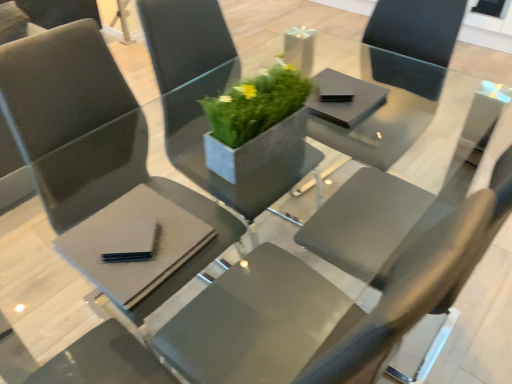
Question: Is black matte pad at lower left, arranged as the first pad when ordered from the bottom, positioned beyond the bounds of black matte napkin at center, the 1th pad from the top?

Choices:
 (A) yes
 (B) no

Answer: (A)

Question: Is black matte pad at lower left, arranged as the first pad when ordered from the bottom, far away from black matte napkin at center, marked as the first pad in a right-to-left arrangement?

Choices:
 (A) yes
 (B) no

Answer: (B)

Question: From a real-world perspective, does black matte pad at lower left, arranged as the first pad when ordered from the bottom, stand above black matte napkin at center, the 1th pad from the top?

Choices:
 (A) no
 (B) yes

Answer: (A)

Question: Can you confirm if black matte pad at lower left, acting as the first pad starting from the front, is shorter than black matte napkin at center, the 1th pad from the back?

Choices:
 (A) yes
 (B) no

Answer: (B)

Question: Considering the relative sizes of black matte pad at lower left, marked as the 2th pad in a top-to-bottom arrangement, and black matte napkin at center, which is the second pad in bottom-to-top order, in the image provided, is black matte pad at lower left, marked as the 2th pad in a top-to-bottom arrangement, thinner than black matte napkin at center, which is the second pad in bottom-to-top order,?

Choices:
 (A) yes
 (B) no

Answer: (A)

Question: From a real-world perspective, is matte gray chair at center, placed as the first chair when sorted from right to left, physically located above or below black matte napkin at center, which is the second pad in bottom-to-top order?

Choices:
 (A) below
 (B) above

Answer: (A)

Question: Based on their sizes in the image, would you say matte gray chair at center, the 2th chair from the left, is bigger or smaller than black matte napkin at center, which is the second pad in left-to-right order?

Choices:
 (A) big
 (B) small

Answer: (A)

Question: From the image's perspective, relative to black matte napkin at center, which is the second pad in left-to-right order, is matte gray chair at center, placed as the first chair when sorted from right to left, above or below?

Choices:
 (A) above
 (B) below

Answer: (B)

Question: Considering the positions of point (208, 172) and point (330, 119), is point (208, 172) closer or farther from the camera than point (330, 119)?

Choices:
 (A) closer
 (B) farther

Answer: (B)

Question: From the image's perspective, is matte gray chair at center, marked as the 2th chair in a right-to-left arrangement, located above or below green concrete planter at center?

Choices:
 (A) above
 (B) below

Answer: (B)

Question: Considering the positions of point (172, 201) and point (271, 193), is point (172, 201) closer or farther from the camera than point (271, 193)?

Choices:
 (A) closer
 (B) farther

Answer: (A)

Question: Would you say matte gray chair at center, marked as the 2th chair in a right-to-left arrangement, is inside or outside green concrete planter at center?

Choices:
 (A) inside
 (B) outside

Answer: (B)

Question: Is matte gray chair at center, marked as the 2th chair in a right-to-left arrangement, to the left or to the right of green concrete planter at center in the image?

Choices:
 (A) left
 (B) right

Answer: (A)

Question: Considering the positions of matte gray chair at center, placed as the first chair when sorted from right to left, and matte black table at center in the image, is matte gray chair at center, placed as the first chair when sorted from right to left, wider or thinner than matte black table at center?

Choices:
 (A) thin
 (B) wide

Answer: (A)

Question: Considering the positions of point (223, 24) and point (423, 175), is point (223, 24) closer or farther from the camera than point (423, 175)?

Choices:
 (A) farther
 (B) closer

Answer: (B)